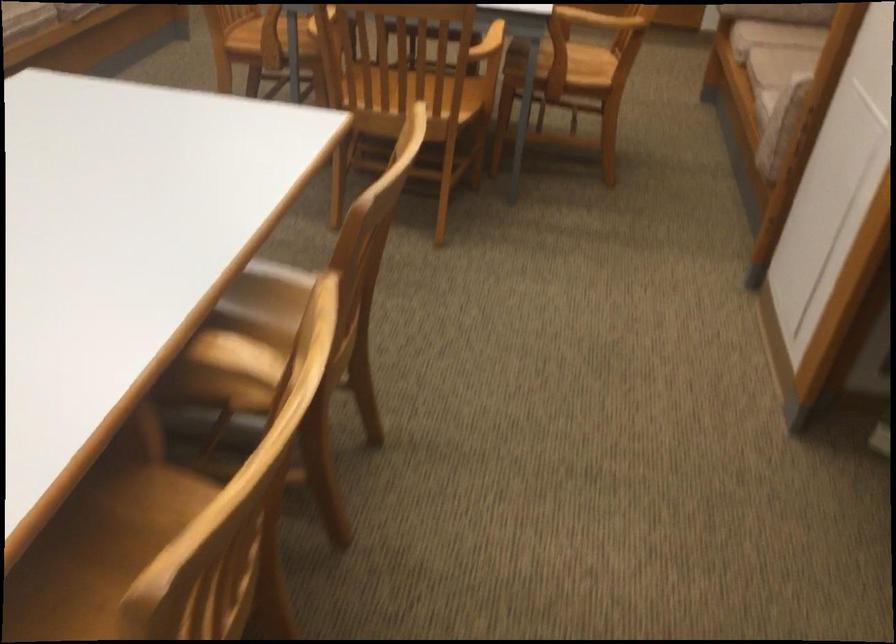
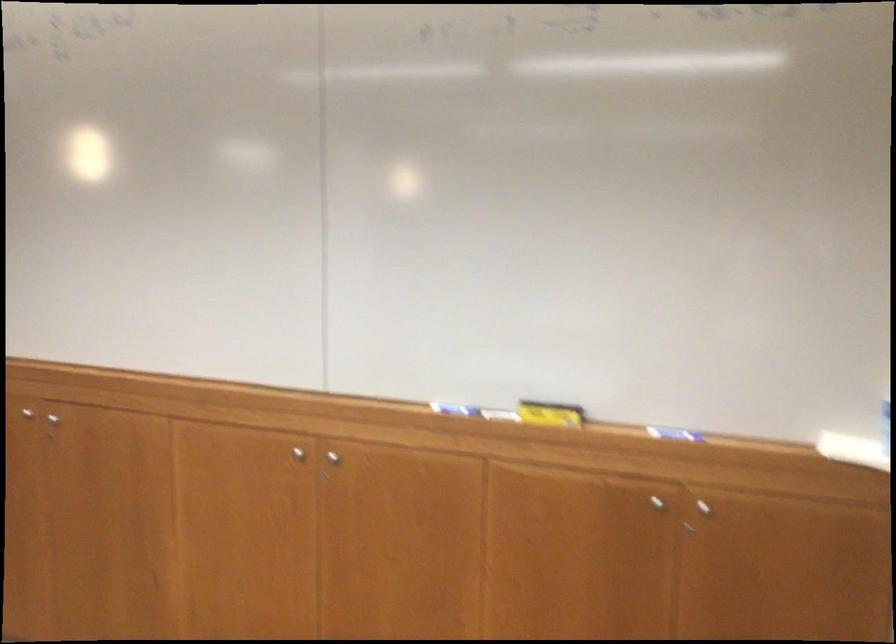
Which direction would the cameraman need to move to produce the second image?

The cameraman moved toward right, forward.